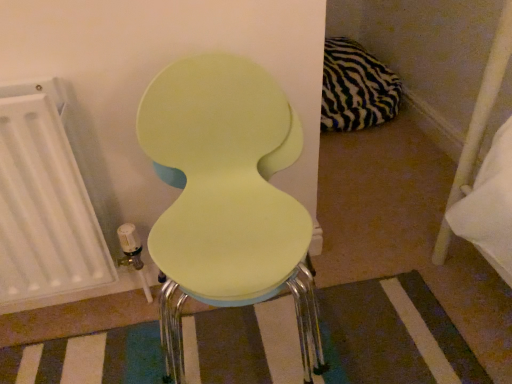
Locate an element on the screen. zebra-patterned fabric pillow at upper right is located at coordinates click(x=356, y=88).

Locate an element on the screen. matte yellow stool at center is located at coordinates (392, 335).

The height and width of the screenshot is (384, 512). Identify the location of matte green chair at center. (227, 195).

Find the location of a particular element. The height and width of the screenshot is (384, 512). white matte radiator at left is located at coordinates (45, 205).

Is white matte radiator at left to the right of matte green chair at center from the viewer's perspective?

Incorrect, white matte radiator at left is not on the right side of matte green chair at center.

Is white matte radiator at left outside of matte green chair at center?

white matte radiator at left lies outside matte green chair at center's area.

How many degrees apart are the facing directions of white matte radiator at left and matte green chair at center?

There is a 0.324-degree angle between the facing directions of white matte radiator at left and matte green chair at center.

Is white matte radiator at left oriented away from matte green chair at center?

white matte radiator at left is not turned away from matte green chair at center.

Is zebra-patterned fabric pillow at upper right turned away from white matte radiator at left?

zebra-patterned fabric pillow at upper right is not turned away from white matte radiator at left.

Between point (351, 124) and point (38, 110), which one is positioned in front?

Point (38, 110)

From a real-world perspective, is zebra-patterned fabric pillow at upper right on white matte radiator at left?

Actually, zebra-patterned fabric pillow at upper right is physically below white matte radiator at left in the real world.

From the image's perspective, between matte yellow stool at center and white matte radiator at left, who is located below?

matte yellow stool at center appears lower in the image.

Does point (340, 322) appear closer or farther from the camera than point (3, 169)?

Point (340, 322) appears to be farther away from the viewer than point (3, 169).

Image resolution: width=512 pixels, height=384 pixels. In the image, there is a matte yellow stool at center. Find the location of `radiator above it (from the image's perspective)`. radiator above it (from the image's perspective) is located at coordinates (45, 205).

Can you tell me how much matte yellow stool at center and white matte radiator at left differ in facing direction?

They differ by 0.654 degrees in their facing directions.

Is the position of matte green chair at center less distant than that of white matte radiator at left?

Yes, it is in front of white matte radiator at left.

How different are the orientations of matte green chair at center and white matte radiator at left in degrees?

The angle between the facing direction of matte green chair at center and the facing direction of white matte radiator at left is 0.324 degrees.

Identify the location of radiator that is behind the matte green chair at center. The width and height of the screenshot is (512, 384). (45, 205).

Is there a large distance between matte green chair at center and white matte radiator at left?

No, matte green chair at center is not far away from white matte radiator at left.

Is white matte radiator at left turned away from matte yellow stool at center?

No, matte yellow stool at center is not at the back of white matte radiator at left.

What's the angular difference between white matte radiator at left and matte yellow stool at center's facing directions?

0.654 degrees.

Is white matte radiator at left positioned in front of matte yellow stool at center?

Yes, white matte radiator at left is in front of matte yellow stool at center.

Who is taller, white matte radiator at left or matte yellow stool at center?

white matte radiator at left is taller.

In terms of width, does matte yellow stool at center look wider or thinner when compared to matte green chair at center?

Considering their sizes, matte yellow stool at center looks slimmer than matte green chair at center.

Which point is more forward, (139, 368) or (143, 126)?

The point (143, 126) is in front.

Relative to matte green chair at center, is matte yellow stool at center in front or behind?

In the image, matte yellow stool at center appears behind matte green chair at center.

This screenshot has height=384, width=512. Find the location of `radiator that is above the zebra-patterned fabric pillow at upper right (from a real-world perspective)`. radiator that is above the zebra-patterned fabric pillow at upper right (from a real-world perspective) is located at coordinates (45, 205).

Would you say white matte radiator at left is inside or outside zebra-patterned fabric pillow at upper right?

white matte radiator at left lies outside zebra-patterned fabric pillow at upper right.

From the image's perspective, is white matte radiator at left located beneath zebra-patterned fabric pillow at upper right?

Yes.

Is white matte radiator at left looking in the opposite direction of zebra-patterned fabric pillow at upper right?

No, zebra-patterned fabric pillow at upper right is not at the back of white matte radiator at left.

Locate an element on the screen. This screenshot has height=384, width=512. toilet in front of the white matte radiator at left is located at coordinates (227, 195).

Find the location of `radiator below the zebra-patterned fabric pillow at upper right (from the image's perspective)`. radiator below the zebra-patterned fabric pillow at upper right (from the image's perspective) is located at coordinates (45, 205).

Considering their positions, is white matte radiator at left positioned further to matte yellow stool at center than matte green chair at center?

The object further to matte yellow stool at center is matte green chair at center.

Considering their positions, is matte yellow stool at center positioned closer to zebra-patterned fabric pillow at upper right than white matte radiator at left?

matte yellow stool at center is positioned closer to the anchor zebra-patterned fabric pillow at upper right.

Based on the photo, which object lies nearer to the anchor point zebra-patterned fabric pillow at upper right, white matte radiator at left or matte yellow stool at center?

Among the two, matte yellow stool at center is located nearer to zebra-patterned fabric pillow at upper right.

Which object lies nearer to the anchor point zebra-patterned fabric pillow at upper right, matte green chair at center or matte yellow stool at center?

matte yellow stool at center.

From the picture: Which object lies nearer to the anchor point white matte radiator at left, matte green chair at center or zebra-patterned fabric pillow at upper right?

matte green chair at center is positioned closer to the anchor white matte radiator at left.

Which object lies further to the anchor point zebra-patterned fabric pillow at upper right, matte yellow stool at center or matte green chair at center?

matte green chair at center is positioned further to the anchor zebra-patterned fabric pillow at upper right.

When comparing their distances from matte yellow stool at center, does matte green chair at center or zebra-patterned fabric pillow at upper right seem further?

zebra-patterned fabric pillow at upper right is positioned further to the anchor matte yellow stool at center.

When comparing their distances from matte green chair at center, does matte yellow stool at center or zebra-patterned fabric pillow at upper right seem further?

The object further to matte green chair at center is zebra-patterned fabric pillow at upper right.

You are a GUI agent. You are given a task and a screenshot of the screen. Output one action in this format:
    pyautogui.click(x=<x>, y=<y>)
    Task: Click on the strip between white matte radiator at left and zebra-patterned fabric pillow at upper right from front to back
    This screenshot has height=384, width=512.
    Given the screenshot: What is the action you would take?
    pyautogui.click(x=392, y=335)

Locate an element on the screen. strip positioned between matte green chair at center and zebra-patterned fabric pillow at upper right from near to far is located at coordinates (392, 335).

Identify the location of strip between white matte radiator at left and matte green chair at center. The width and height of the screenshot is (512, 384). (392, 335).

Locate an element on the screen. The height and width of the screenshot is (384, 512). radiator between matte green chair at center and zebra-patterned fabric pillow at upper right along the z-axis is located at coordinates (45, 205).